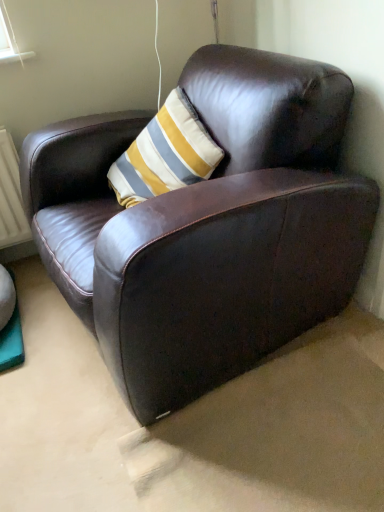
Question: Should I look upward or downward to see shiny brown leather armchair at center?

Choices:
 (A) down
 (B) up

Answer: (B)